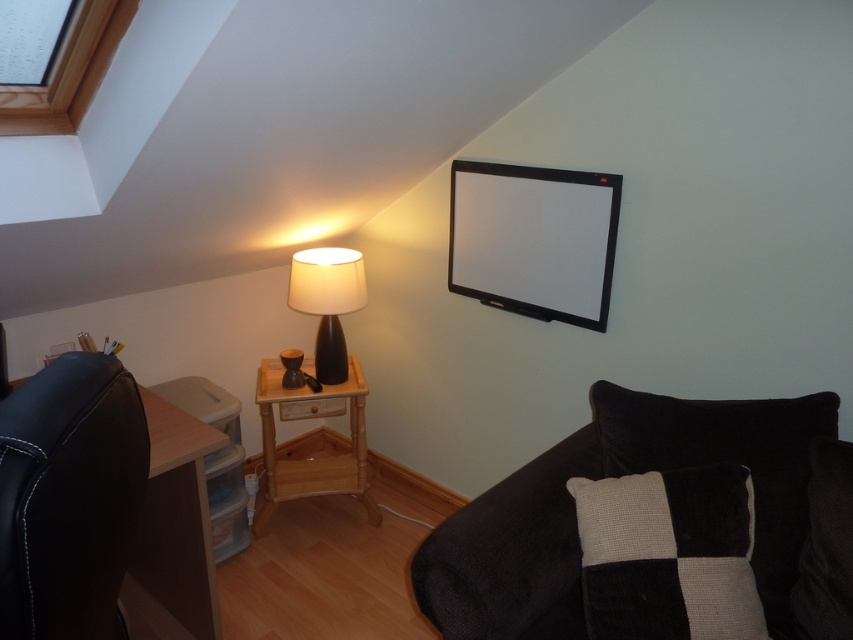
Question: Can you confirm if velvet black couch at lower right is smaller than black leather swivel chair at lower left?

Choices:
 (A) yes
 (B) no

Answer: (B)

Question: Among these points, which one is farthest from the camera?

Choices:
 (A) (312, 296)
 (B) (822, 413)
 (C) (57, 118)

Answer: (A)

Question: Estimate the real-world distances between objects in this image. Which object is farther from the black leather swivel chair at lower left?

Choices:
 (A) natural wood side table at lower left
 (B) black textured pillow at lower right
 (C) transparent glass window at upper left
 (D) velvet black couch at lower right

Answer: (A)

Question: Does black leather swivel chair at lower left appear over transparent glass window at upper left?

Choices:
 (A) yes
 (B) no

Answer: (B)

Question: Can you confirm if velvet black couch at lower right is bigger than black textured pillow at lower right?

Choices:
 (A) no
 (B) yes

Answer: (B)

Question: Which object is the closest to the velvet black couch at lower right?

Choices:
 (A) black leather swivel chair at lower left
 (B) natural wood side table at lower left

Answer: (A)